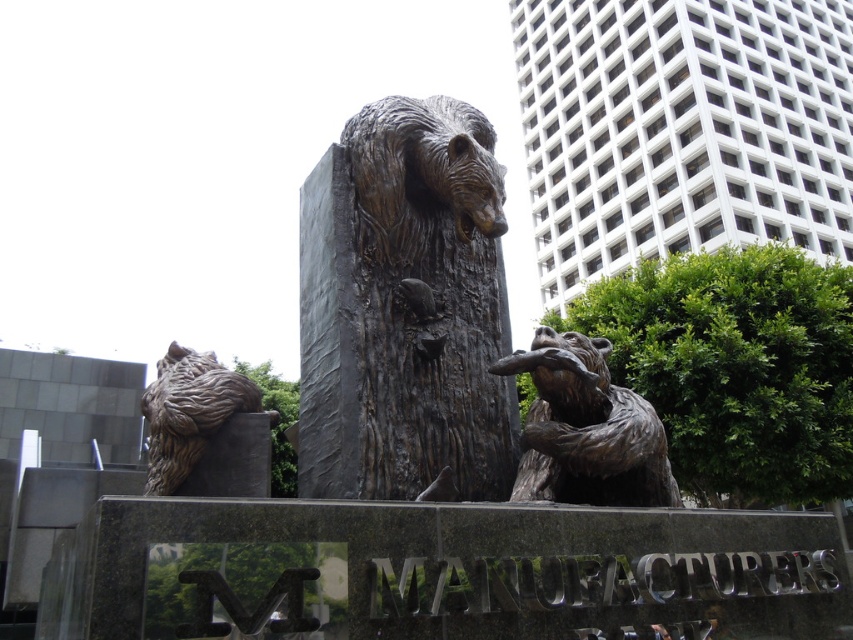
Question: Considering the relative positions of bronze textured bear at center and green matte tree at lower center in the image provided, where is bronze textured bear at center located with respect to green matte tree at lower center?

Choices:
 (A) below
 (B) above

Answer: (B)

Question: Which point is closer to the camera?

Choices:
 (A) [436, 280]
 (B) [802, 340]
 (C) [263, 544]

Answer: (C)

Question: Among these points, which one is nearest to the camera?

Choices:
 (A) (815, 484)
 (B) (332, 218)

Answer: (B)

Question: Is green leafy tree at lower right below green matte tree at lower center?

Choices:
 (A) yes
 (B) no

Answer: (B)

Question: Which point appears closest to the camera in this image?

Choices:
 (A) (572, 424)
 (B) (196, 390)
 (C) (289, 442)
 (D) (585, 332)

Answer: (B)

Question: Considering the relative positions of bronze bear at lower right and green matte tree at lower center in the image provided, where is bronze bear at lower right located with respect to green matte tree at lower center?

Choices:
 (A) left
 (B) right

Answer: (B)